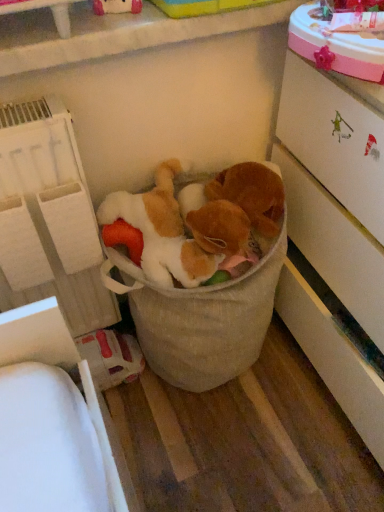
Question: Is white textured shelf at left to the left or to the right of fluffy beige stuffed animals at center in the image?

Choices:
 (A) right
 (B) left

Answer: (B)

Question: Looking at the image, does white textured shelf at left seem bigger or smaller compared to fluffy beige stuffed animals at center?

Choices:
 (A) small
 (B) big

Answer: (A)

Question: Considering the real-world distances, which object is closest to the white glossy cabinet at right?

Choices:
 (A) white textured shelf at left
 (B) fluffy beige stuffed animals at center

Answer: (B)

Question: Which object is positioned farthest from the fluffy beige stuffed animals at center?

Choices:
 (A) white textured shelf at left
 (B) white glossy cabinet at right

Answer: (B)